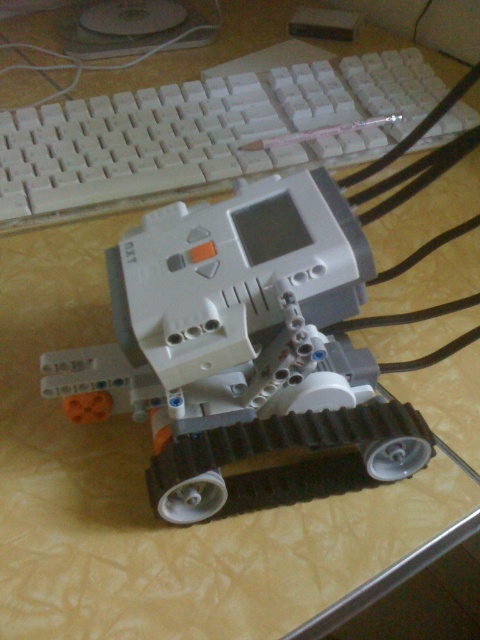
Does white plastic robot at center appear under white plastic keyboard at upper center?

Correct, white plastic robot at center is located below white plastic keyboard at upper center.

Which is below, white plastic robot at center or white plastic keyboard at upper center?

white plastic robot at center

Is point (196, 412) positioned in front of point (228, 141)?

Yes.

Identify the location of white plastic robot at center. (240, 342).